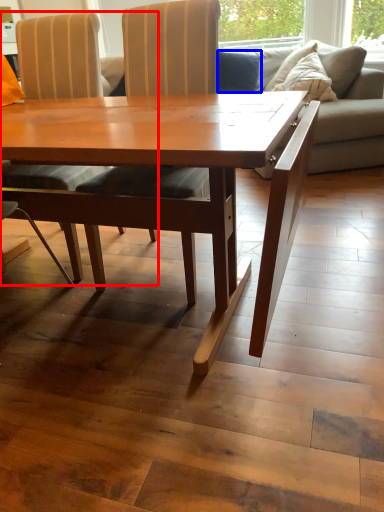
Question: Which of the following is the farthest to the observer, chair (highlighted by a red box) or pillow (highlighted by a blue box)?

Choices:
 (A) chair
 (B) pillow

Answer: (B)